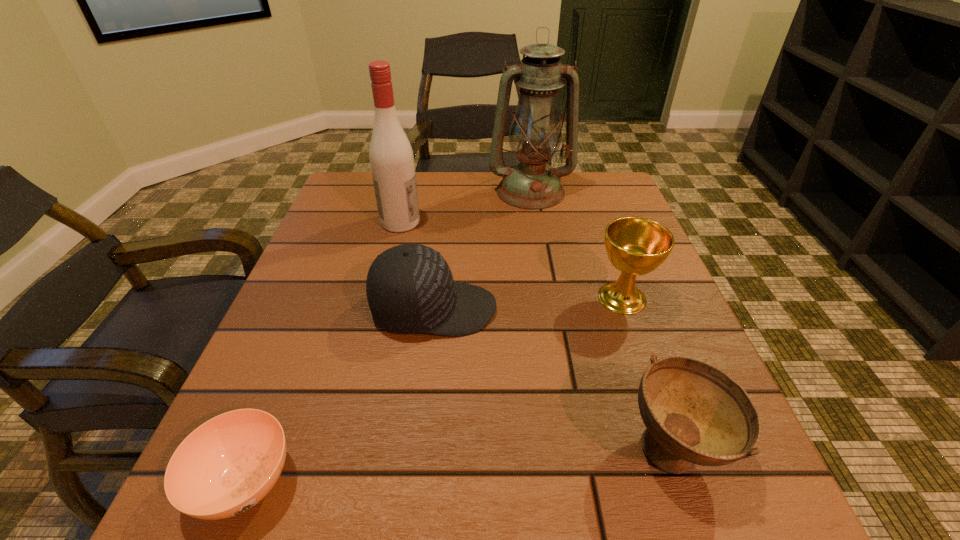
Identify the location of free area in between the baseball cap and the oil lamp. The image size is (960, 540). (482, 250).

Identify the location of the closest object relative to the chalice. The image size is (960, 540). (694, 413).

Where is `object that is the closest one to the second farthest object`? The height and width of the screenshot is (540, 960). object that is the closest one to the second farthest object is located at coordinates (535, 134).

I want to click on vacant space that satisfies the following two spatial constraints: 1. at the front of the baseball cap where the brim is located; 2. on the right side of the right soup bowl, so click(419, 449).